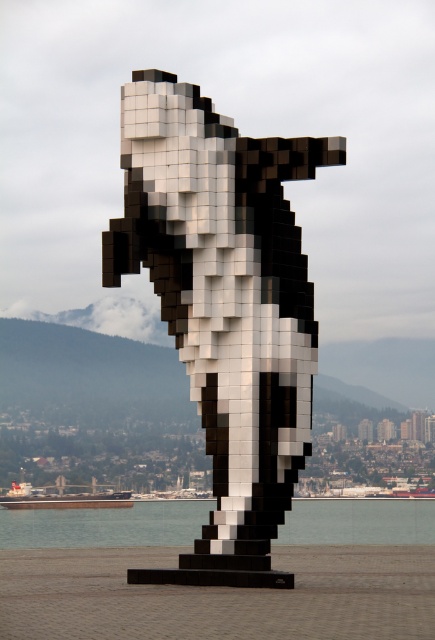
Question: Which of the following is the closest to the observer?

Choices:
 (A) black pixelated orca at center
 (B) transparent glass water at lower center

Answer: (A)

Question: Which of the following is the closest to the observer?

Choices:
 (A) transparent glass water at lower center
 (B) black pixelated orca at center

Answer: (B)

Question: Is black pixelated orca at center to the left of transparent glass water at lower center from the viewer's perspective?

Choices:
 (A) yes
 (B) no

Answer: (B)

Question: Is black pixelated orca at center to the left of transparent glass water at lower center from the viewer's perspective?

Choices:
 (A) yes
 (B) no

Answer: (B)

Question: Which of the following is the farthest from the observer?

Choices:
 (A) transparent glass water at lower center
 (B) black pixelated orca at center

Answer: (A)

Question: Can you confirm if black pixelated orca at center is wider than transparent glass water at lower center?

Choices:
 (A) yes
 (B) no

Answer: (B)